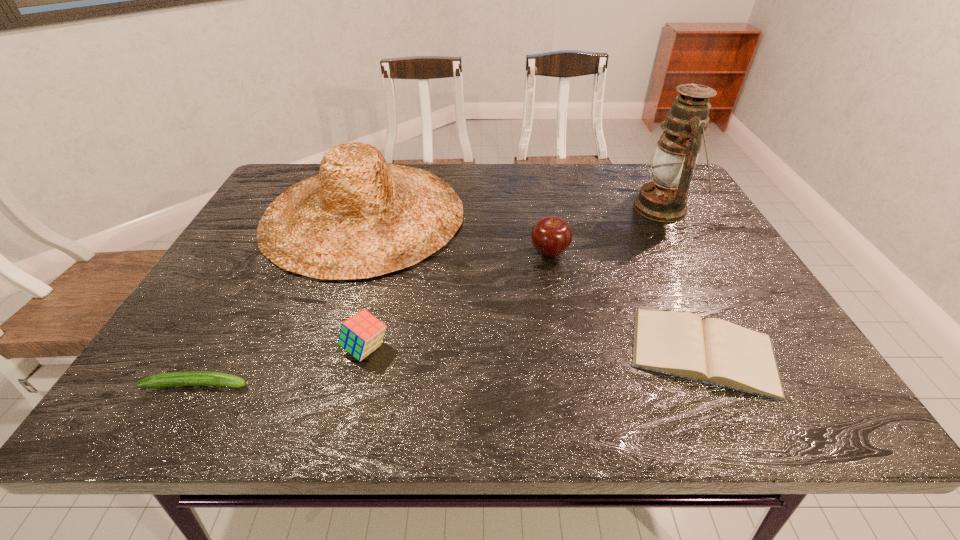
This screenshot has width=960, height=540. What are the coordinates of `the tallest object` in the screenshot? It's located at (664, 199).

This screenshot has height=540, width=960. I want to click on sunhat, so click(360, 217).

Image resolution: width=960 pixels, height=540 pixels. In order to click on the fourth object from left to right in this screenshot , I will do `click(551, 236)`.

This screenshot has height=540, width=960. What are the coordinates of `apple` in the screenshot? It's located at (551, 236).

Locate an element on the screen. cube is located at coordinates (361, 334).

This screenshot has width=960, height=540. Identify the location of zucchini. (188, 378).

At what (x,y) coordinates should I click in order to perform the action: click on Bible. Please return your answer as a coordinate pair (x, y). This screenshot has width=960, height=540. Looking at the image, I should click on (713, 351).

Locate an element on the screen. This screenshot has height=540, width=960. free point located 0.270m on the left of the lantern is located at coordinates (540, 208).

The image size is (960, 540). What are the coordinates of `vacant space positioned 0.340m on the right of the fifth shortest object` in the screenshot? It's located at (583, 215).

I want to click on vacant space situated 0.050m on the back of the fourth object from left to right, so click(545, 229).